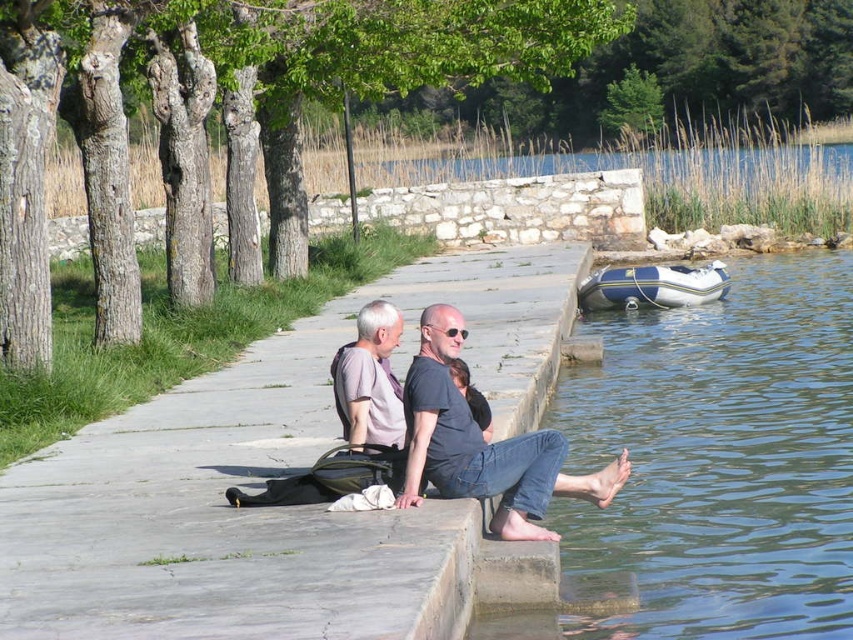
Can you confirm if blue rubber boat at lower left is smaller than matte gray shirt at center?

Incorrect, blue rubber boat at lower left is not smaller in size than matte gray shirt at center.

Between point (566, 502) and point (492, 481), which one is positioned behind?

Point (566, 502)

This screenshot has height=640, width=853. I want to click on blue rubber boat at lower left, so click(x=721, y=458).

This screenshot has height=640, width=853. I want to click on blue rubber boat at lower left, so click(721, 458).

Can you confirm if blue rubber boat at lower left is thinner than white rubber boat at lower right?

Incorrect, blue rubber boat at lower left's width is not less than white rubber boat at lower right's.

This screenshot has width=853, height=640. Identify the location of blue rubber boat at lower left. click(721, 458).

Is point (589, 324) positioned in front of point (612, 307)?

Yes.

At what (x,y) coordinates should I click in order to perform the action: click on blue rubber boat at lower left. Please return your answer as a coordinate pair (x, y). This screenshot has height=640, width=853. Looking at the image, I should click on (721, 458).

Which is below, gray concrete pavement at center or gray fabric shirt at center?

Positioned lower is gray fabric shirt at center.

Does gray concrete pavement at center lie in front of gray fabric shirt at center?

Yes, it is in front of gray fabric shirt at center.

Is point (183, 461) less distant than point (368, 321)?

No.

This screenshot has height=640, width=853. In order to click on gray concrete pavement at center in this screenshot , I will do `click(273, 477)`.